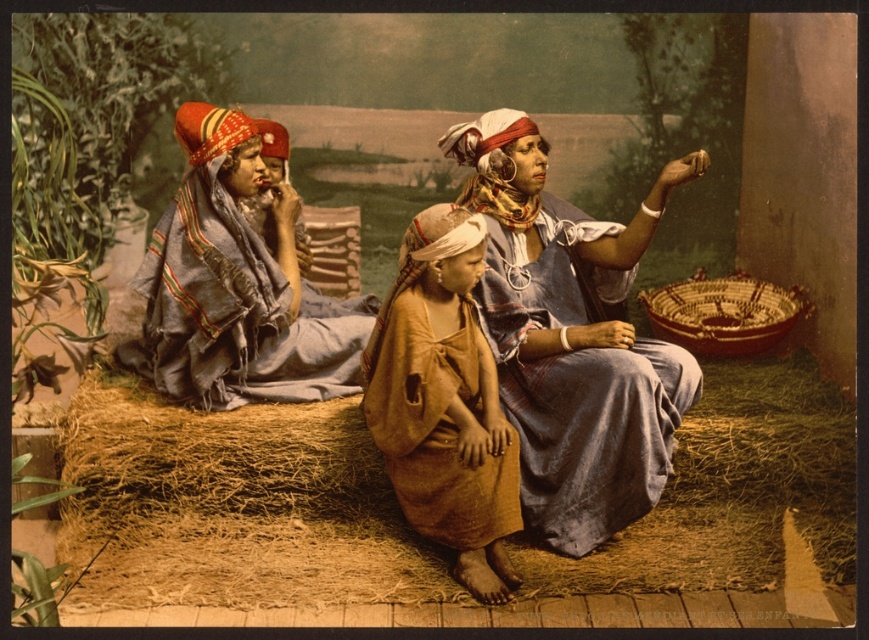
You are a tailor observing the blue woven cloth at left and the red woven fabric headscarf at center. Which of these two items has a greater area?

The blue woven cloth at left has a greater area than the red woven fabric headscarf at center because it is larger in size.